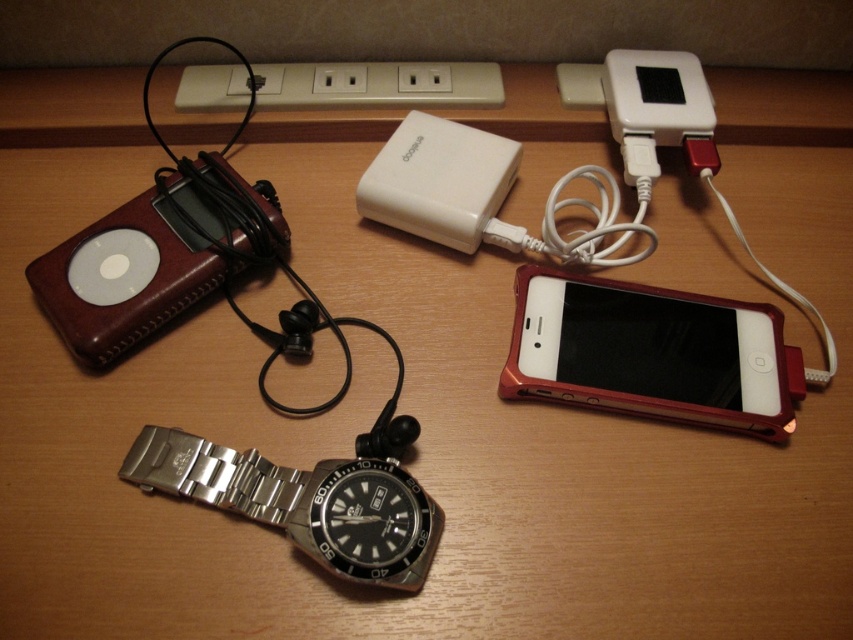
Question: Can you confirm if white plastic plug at upper center is positioned above white plastic ipod at upper right?

Choices:
 (A) yes
 (B) no

Answer: (A)

Question: Estimate the real-world distances between objects in this image. Which object is closer to the leather ipod at left?

Choices:
 (A) metallic red smartphone at lower right
 (B) white plastic ipod at upper right

Answer: (A)

Question: Which point is farther to the camera?

Choices:
 (A) metallic red smartphone at lower right
 (B) white plastic plug at upper center
 (C) silver metallic watch at lower left

Answer: (B)

Question: Estimate the real-world distances between objects in this image. Which object is farther from the silver metallic watch at lower left?

Choices:
 (A) leather ipod at left
 (B) white matte power bank at center
 (C) metallic red smartphone at lower right

Answer: (B)

Question: Does metallic red smartphone at lower right appear on the right side of silver metallic watch at lower left?

Choices:
 (A) yes
 (B) no

Answer: (A)

Question: From the image, what is the correct spatial relationship of metallic red smartphone at lower right in relation to white plastic ipod at upper right?

Choices:
 (A) above
 (B) below

Answer: (B)